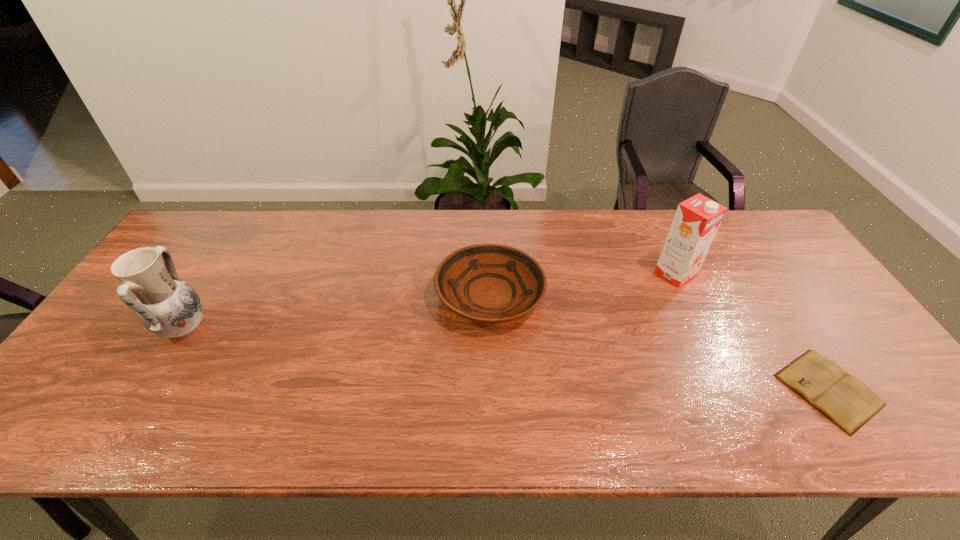
At what (x,y) coordinates should I click in order to perform the action: click on free space between the plate and the carton. Please return your answer as a coordinate pair (x, y). Looking at the image, I should click on (583, 285).

The width and height of the screenshot is (960, 540). I want to click on free area in between the third object from left to right and the second object from left to right, so click(x=583, y=285).

This screenshot has height=540, width=960. I want to click on vacant space that's between the plate and the second object from right to left, so click(583, 285).

What are the coordinates of `free space between the second object from right to left and the shortest object` in the screenshot? It's located at (752, 332).

In order to click on free space between the pottery and the rightmost object in this screenshot , I will do `click(506, 359)`.

At what (x,y) coordinates should I click in order to perform the action: click on free space between the second object from left to right and the carton. Please return your answer as a coordinate pair (x, y). This screenshot has width=960, height=540. Looking at the image, I should click on (583, 285).

Identify the location of blank region between the second object from right to left and the shortest object. This screenshot has width=960, height=540. (752, 332).

In order to click on free space between the pottery and the book in this screenshot , I will do [506, 359].

This screenshot has height=540, width=960. I want to click on vacant point located between the pottery and the rightmost object, so click(506, 359).

The image size is (960, 540). What are the coordinates of `object that is the closest to the book` in the screenshot? It's located at (697, 219).